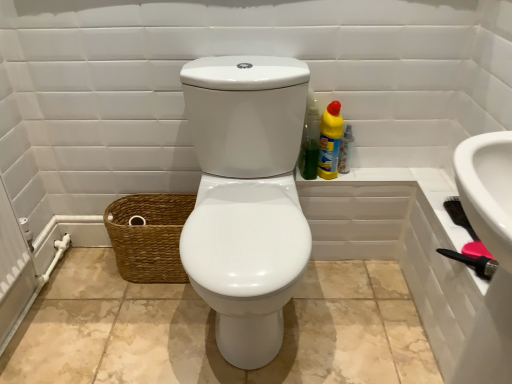
Question: Is brown woven basket at lower left to the left or to the right of translucent plastic spray bottle at right in the image?

Choices:
 (A) right
 (B) left

Answer: (B)

Question: Is brown woven basket at lower left spatially inside translucent plastic spray bottle at right, or outside of it?

Choices:
 (A) inside
 (B) outside

Answer: (B)

Question: Which of these objects is positioned closest to the brown woven basket at lower left?

Choices:
 (A) yellow plastic bottle at upper right, which ranks as the first cleaning product in right-to-left order
 (B) green plastic bottle at upper right, placed as the first cleaning product when sorted from left to right
 (C) translucent plastic spray bottle at right

Answer: (B)

Question: Which object is the closest to the brown woven basket at lower left?

Choices:
 (A) yellow plastic bottle at upper right, acting as the second cleaning product starting from the left
 (B) green plastic bottle at upper right, placed as the first cleaning product when sorted from left to right
 (C) translucent plastic spray bottle at right

Answer: (B)